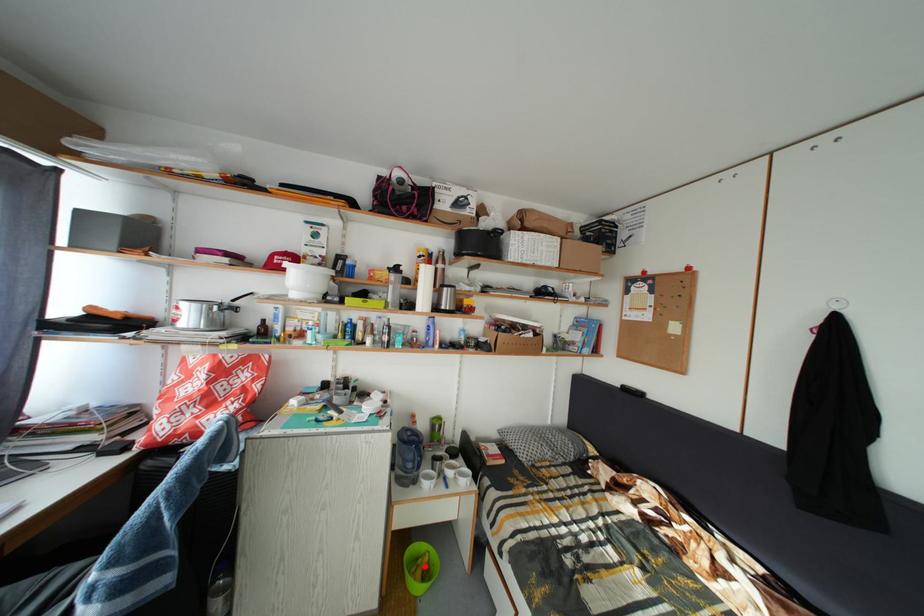
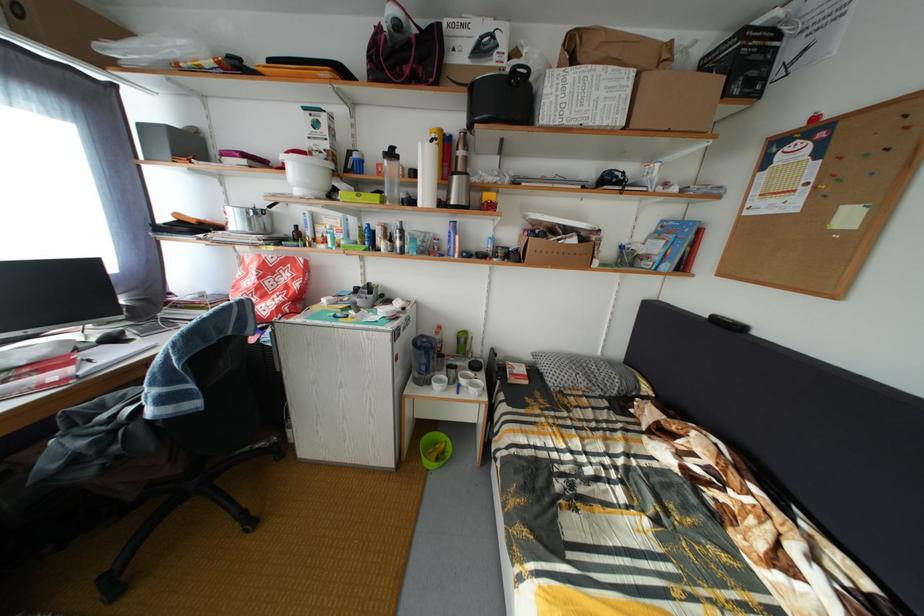
Question: I am providing you with two images of the same scene from different viewpoints. In image1, a red point is highlighted. Considering the same 3D point in image2, which of the following is correct?

Choices:
 (A) It is closer
 (B) It is farther

Answer: (B)